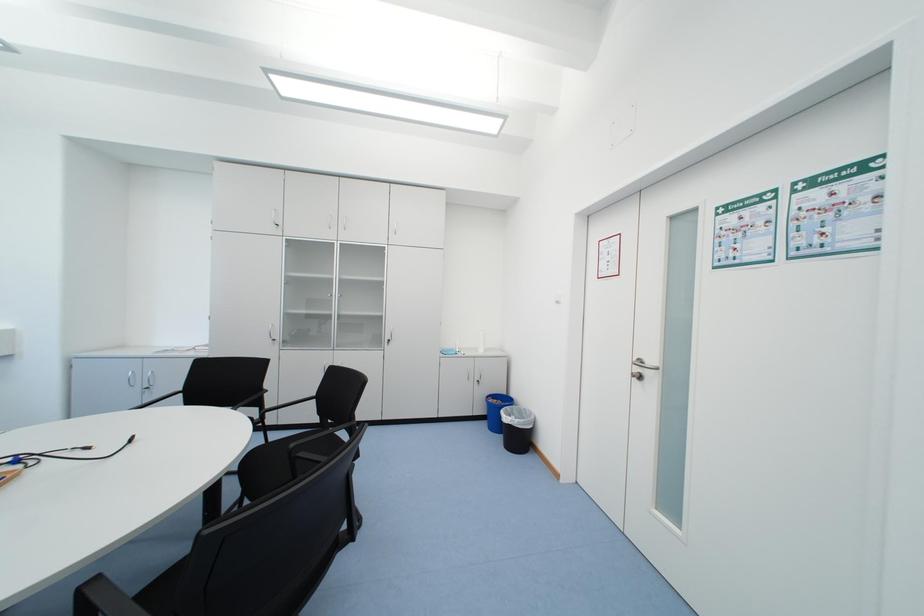
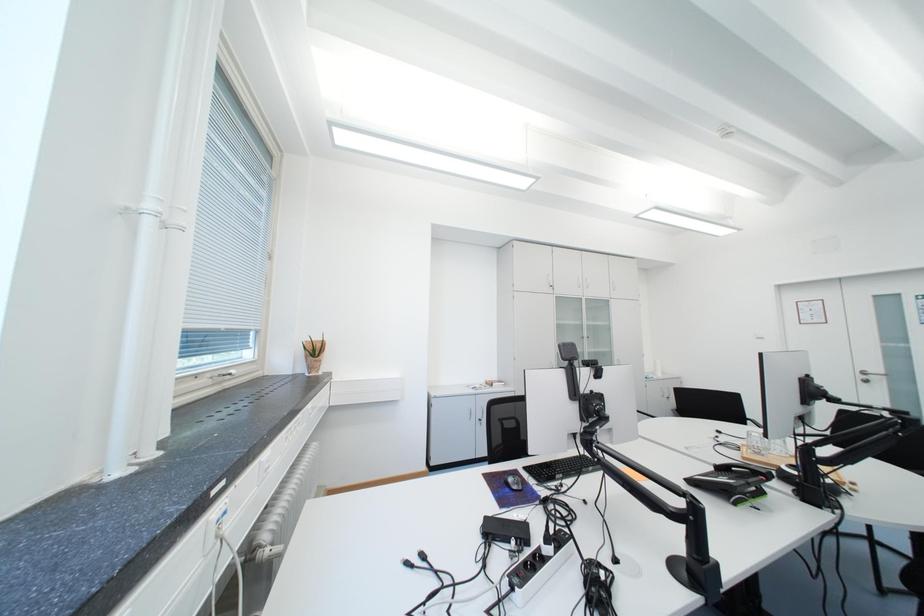
Question: Which direction would the cameraman need to move to produce the second image? Reply with the corresponding letter.

Choices:
 (A) Left
 (B) Right
 (C) Forward
 (D) Backward

Answer: (A)